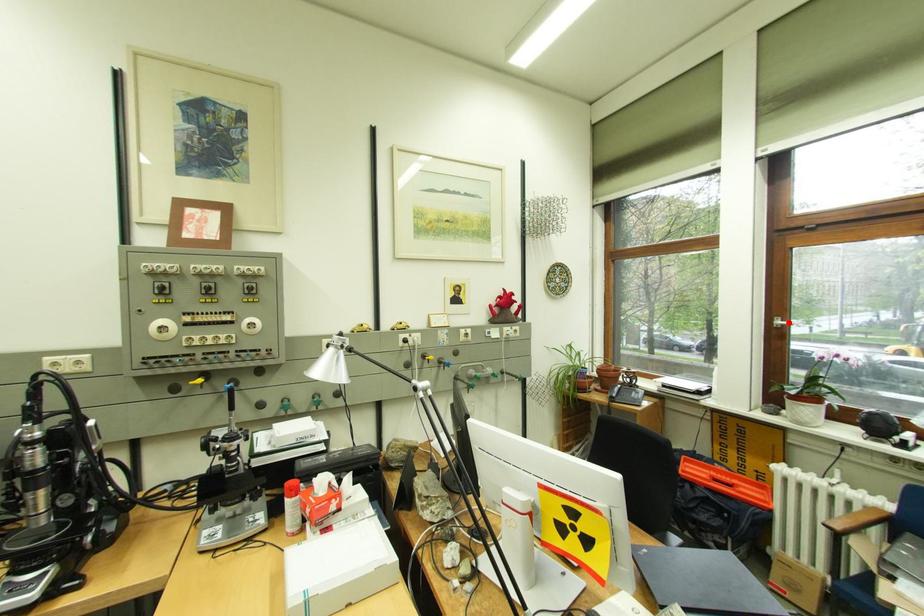
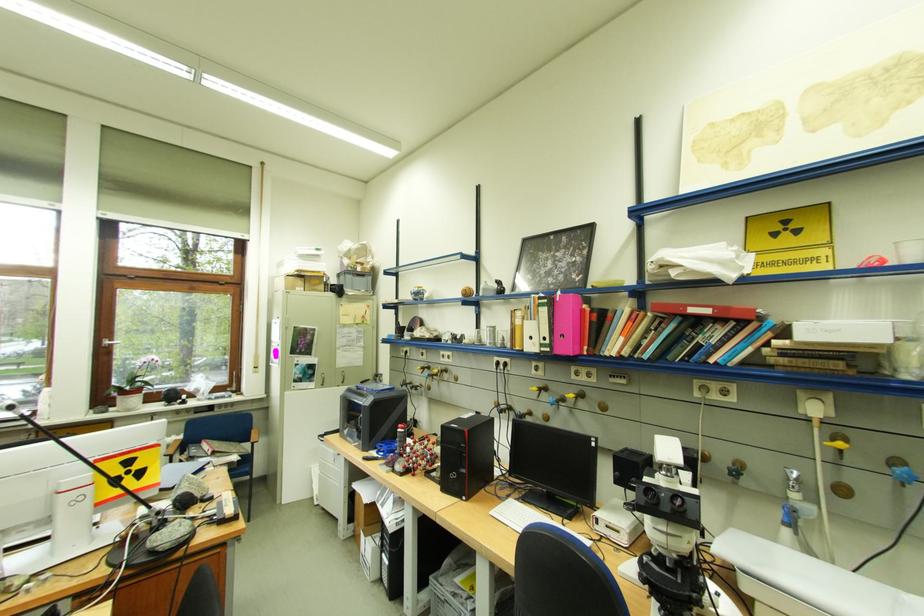
The point at the highlighted location is marked in the first image. Where is the corresponding point in the second image?

(117, 342)